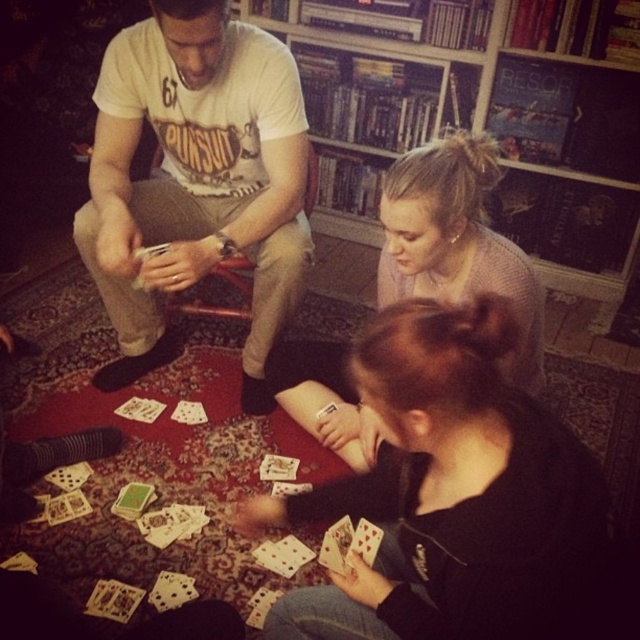
Question: Can you confirm if white cotton t-shirt at center is positioned to the right of smooth pink sweater at center?

Choices:
 (A) yes
 (B) no

Answer: (B)

Question: Which object is closer to the camera taking this photo?

Choices:
 (A) white cotton t-shirt at center
 (B) wooden bookshelf at upper center

Answer: (A)

Question: Does white cotton t-shirt at center have a greater width compared to smooth pink sweater at center?

Choices:
 (A) no
 (B) yes

Answer: (A)

Question: Which point is farther to the camera?

Choices:
 (A) smooth pink sweater at center
 (B) white cotton t-shirt at center
 (C) black matte hair at lower center
 (D) wooden bookshelf at upper center

Answer: (D)

Question: Does white cotton t-shirt at center have a larger size compared to smooth pink sweater at center?

Choices:
 (A) yes
 (B) no

Answer: (A)

Question: Which object is farther from the camera taking this photo?

Choices:
 (A) smooth pink sweater at center
 (B) white cotton t-shirt at center
 (C) black matte hair at lower center
 (D) wooden bookshelf at upper center

Answer: (D)